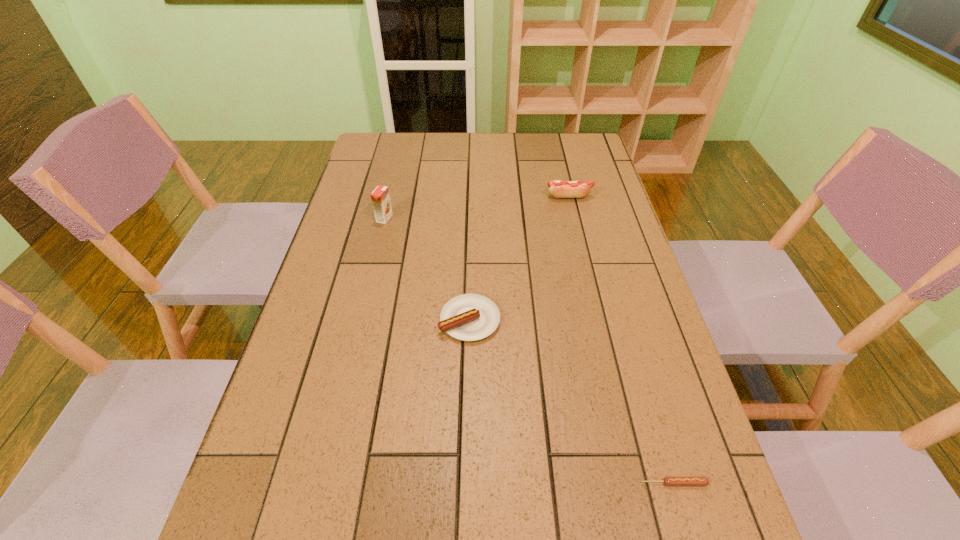
Identify the location of free space between the orange juice and the nearest sausage. (529, 350).

Identify the location of vacant area that lies between the tallest sausage and the shortest sausage. The width and height of the screenshot is (960, 540). (621, 340).

The width and height of the screenshot is (960, 540). Identify the location of vacant area between the third farthest object and the shortest object. (571, 401).

The height and width of the screenshot is (540, 960). I want to click on unoccupied area between the tallest sausage and the third object from right to left, so click(519, 258).

At what (x,y) coordinates should I click in order to perform the action: click on free area in between the second nearest object and the nearest sausage. Please return your answer as a coordinate pair (x, y). This screenshot has height=540, width=960. Looking at the image, I should click on (571, 401).

At what (x,y) coordinates should I click in order to perform the action: click on empty space that is in between the second tallest object and the third nearest object. Please return your answer as a coordinate pair (x, y). Looking at the image, I should click on (477, 207).

The image size is (960, 540). I want to click on unoccupied area between the leftmost object and the farthest object, so click(x=477, y=207).

You are a GUI agent. You are given a task and a screenshot of the screen. Output one action in this format:
    pyautogui.click(x=<x>, y=<y>)
    Task: Click on the free space between the farthest object and the shortest object
    
    Given the screenshot: What is the action you would take?
    pyautogui.click(x=621, y=340)

Select which object is the second closest to the farthest object. Please provide its 2D coordinates. Your answer should be formatted as a tuple, i.e. [(x, y)], where the tuple contains the x and y coordinates of a point satisfying the conditions above.

[(380, 197)]

At what (x,y) coordinates should I click in order to perform the action: click on the second closest object to the leftmost sausage. Please return your answer as a coordinate pair (x, y). Image resolution: width=960 pixels, height=540 pixels. Looking at the image, I should click on (668, 481).